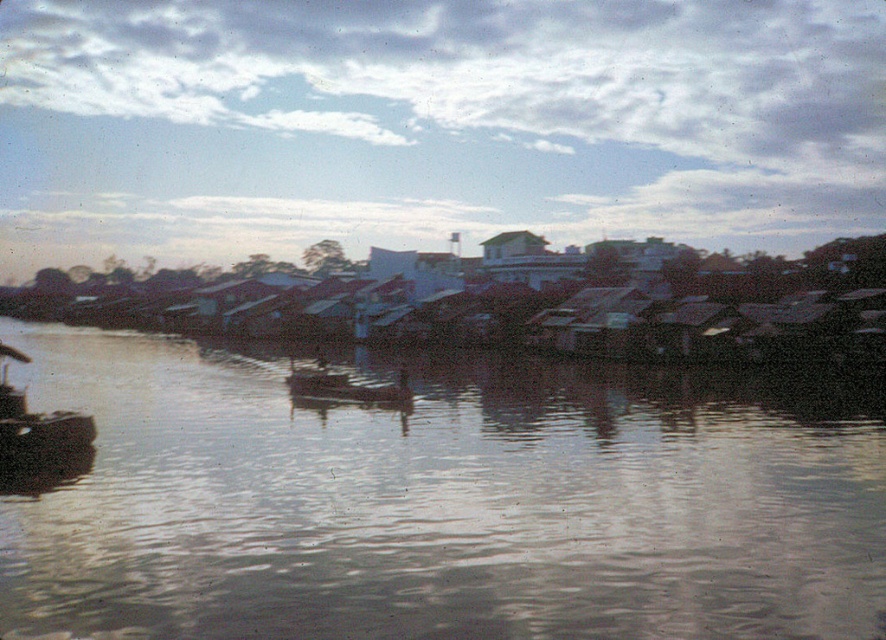
Question: Is brown matte water at center below wooden boat at center?

Choices:
 (A) no
 (B) yes

Answer: (B)

Question: Where is brown matte water at center located in relation to wooden boat at lower left in the image?

Choices:
 (A) right
 (B) left

Answer: (A)

Question: Estimate the real-world distances between objects in this image. Which object is closer to the wooden boat at lower left?

Choices:
 (A) brown matte water at center
 (B) wooden boat at center

Answer: (B)

Question: Which of the following is the farthest from the observer?

Choices:
 (A) wooden boat at lower left
 (B) brown matte water at center
 (C) wooden boat at center

Answer: (C)

Question: Which object appears closest to the camera in this image?

Choices:
 (A) brown matte water at center
 (B) wooden boat at center

Answer: (A)

Question: Observing the image, what is the correct spatial positioning of brown matte water at center in reference to wooden boat at lower left?

Choices:
 (A) below
 (B) above

Answer: (A)